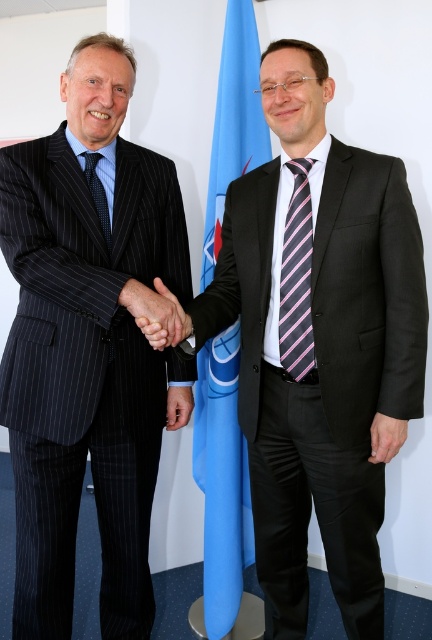
Question: Can you confirm if matte black suit at left is bigger than blue fabric flag at center?

Choices:
 (A) yes
 (B) no

Answer: (A)

Question: Among these points, which one is farthest from the camera?

Choices:
 (A) (289, 280)
 (B) (92, 195)
 (C) (187, 419)
 (D) (368, 552)

Answer: (C)

Question: Which point appears closest to the camera in this image?

Choices:
 (A) click(x=180, y=420)
 (B) click(x=156, y=310)
 (C) click(x=307, y=218)
 (D) click(x=95, y=188)

Answer: (B)

Question: Among these objects, which one is nearest to the camera?

Choices:
 (A) matte blue shirt at center
 (B) matte black suit at center
 (C) blue fabric flag at center
 (D) matte black hand at center

Answer: (B)

Question: Is pink striped tie at center smaller than black silk hand at center?

Choices:
 (A) no
 (B) yes

Answer: (B)

Question: Is matte black suit at left smaller than blue fabric flag at center?

Choices:
 (A) no
 (B) yes

Answer: (A)